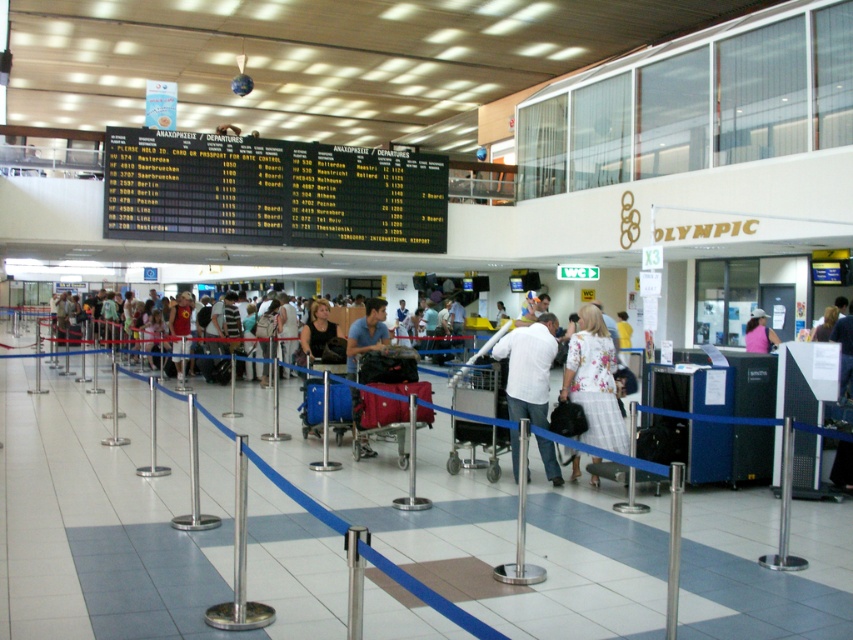
Question: From the image, what is the correct spatial relationship of blue fabric suitcase at center in relation to metallic pole at center?

Choices:
 (A) left
 (B) right

Answer: (A)

Question: Which object appears farthest from the camera in this image?

Choices:
 (A) blue fabric shirt at center
 (B) maroon fabric suitcase at center

Answer: (A)

Question: Can you confirm if floral-patterned dress at center is positioned below metallic pole at center?

Choices:
 (A) no
 (B) yes

Answer: (A)

Question: Which is farther from the metallic pole at center?

Choices:
 (A) blue fabric shirt at center
 (B) white matte shirt at center
 (C) maroon fabric suitcase at center

Answer: (A)

Question: Which object is farther from the camera taking this photo?

Choices:
 (A) blue fabric suitcase at center
 (B) pink fabric shirt at center
 (C) maroon fabric suitcase at center
 (D) metallic pole at center

Answer: (B)

Question: Does maroon fabric suitcase at center come behind blue fabric suitcase at center?

Choices:
 (A) no
 (B) yes

Answer: (A)